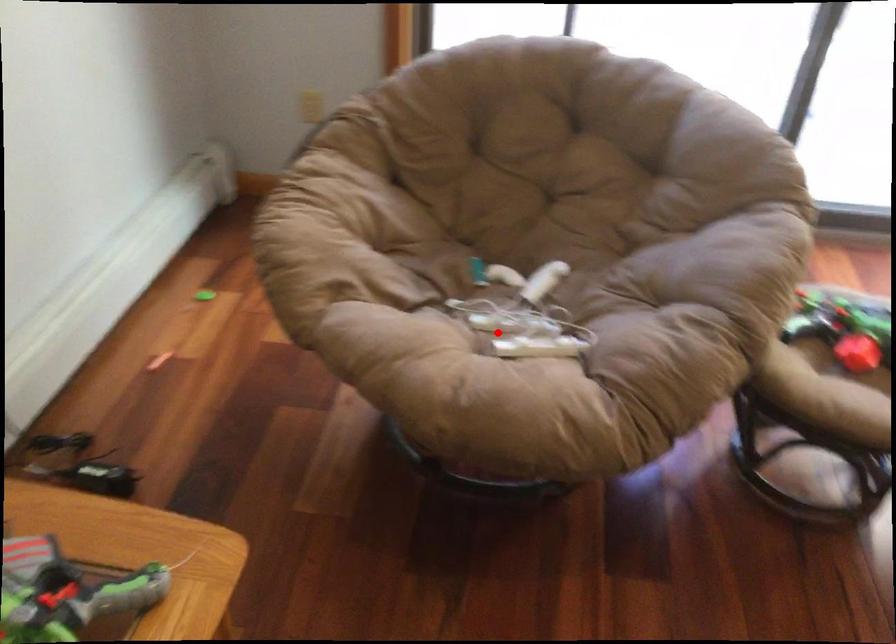
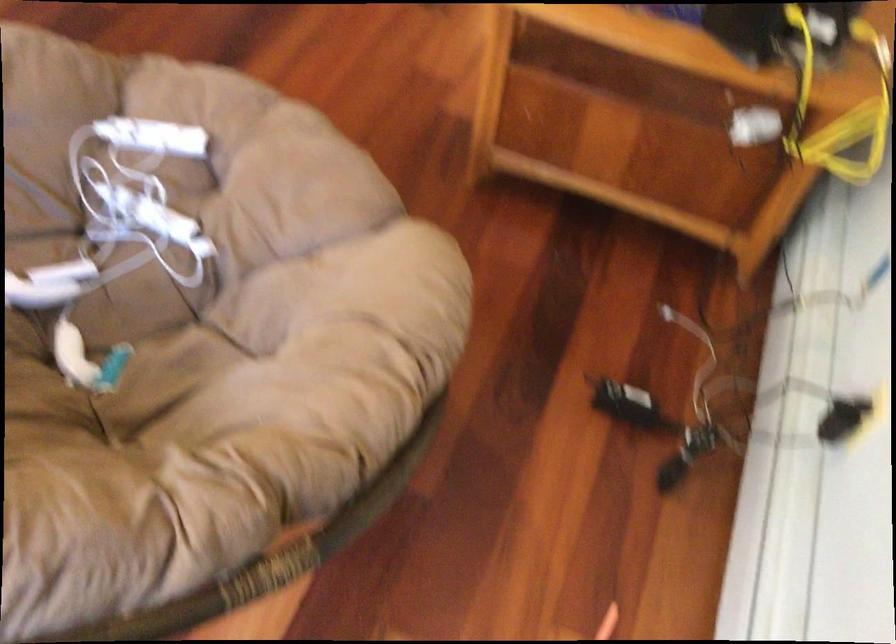
Question: I am providing you with two images of the same scene from different viewpoints. A red point is marked on the first image. Can you still see the location of the red point in image 2?

Choices:
 (A) Yes
 (B) No

Answer: (A)